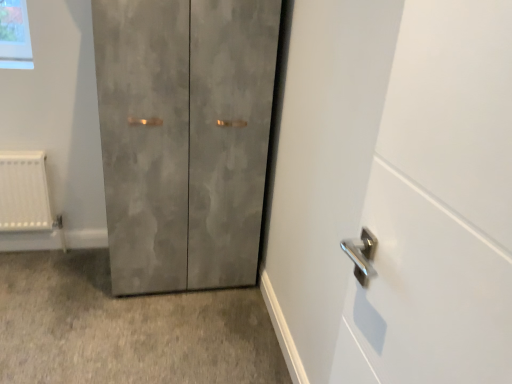
Locate an element on the screen. The height and width of the screenshot is (384, 512). concrete textured cabinet at lower left is located at coordinates (126, 328).

The height and width of the screenshot is (384, 512). Describe the element at coordinates (126, 328) in the screenshot. I see `concrete textured cabinet at lower left` at that location.

Describe the element at coordinates (185, 138) in the screenshot. I see `matte gray cabinet at center` at that location.

At what (x,y) coordinates should I click in order to perform the action: click on matte gray cabinet at center. Please return your answer as a coordinate pair (x, y). This screenshot has width=512, height=384. Looking at the image, I should click on (185, 138).

At what (x,y) coordinates should I click in order to perform the action: click on concrete textured cabinet at lower left. Please return your answer as a coordinate pair (x, y). This screenshot has width=512, height=384. Looking at the image, I should click on (126, 328).

Would you say concrete textured cabinet at lower left is to the left or to the right of matte gray cabinet at center in the picture?

A: Based on their positions, concrete textured cabinet at lower left is located to the left of matte gray cabinet at center.

Is concrete textured cabinet at lower left in front of or behind matte gray cabinet at center in the image?

In the image, concrete textured cabinet at lower left appears in front of matte gray cabinet at center.

Is point (97, 317) closer or farther from the camera than point (193, 72)?

Point (97, 317) appears to be farther away from the viewer than point (193, 72).

From the image's perspective, is concrete textured cabinet at lower left over matte gray cabinet at center?

No.

From a real-world perspective, between concrete textured cabinet at lower left and matte gray cabinet at center, who is vertically lower?

concrete textured cabinet at lower left, from a real-world perspective.

Looking at this image, considering the relative sizes of concrete textured cabinet at lower left and matte gray cabinet at center in the image provided, is concrete textured cabinet at lower left thinner than matte gray cabinet at center?

In fact, concrete textured cabinet at lower left might be wider than matte gray cabinet at center.

Which of these two, concrete textured cabinet at lower left or matte gray cabinet at center, stands taller?

matte gray cabinet at center.

Is concrete textured cabinet at lower left bigger than matte gray cabinet at center?

Incorrect, concrete textured cabinet at lower left is not larger than matte gray cabinet at center.

Is concrete textured cabinet at lower left inside or outside of matte gray cabinet at center?

concrete textured cabinet at lower left is outside matte gray cabinet at center.

Is concrete textured cabinet at lower left positioned far away from matte gray cabinet at center?

Actually, concrete textured cabinet at lower left and matte gray cabinet at center are a little close together.

Is concrete textured cabinet at lower left oriented towards matte gray cabinet at center?

No, concrete textured cabinet at lower left is not facing towards matte gray cabinet at center.

What's the angular difference between concrete textured cabinet at lower left and matte gray cabinet at center's facing directions?

89.8 degrees.

Measure the distance between concrete textured cabinet at lower left and matte gray cabinet at center.

They are 23.54 inches apart.

Find the location of a particular element. concrete below the matte gray cabinet at center (from a real-world perspective) is located at coordinates (126, 328).

Is matte gray cabinet at center at the left side of concrete textured cabinet at lower left?

No, matte gray cabinet at center is not to the left of concrete textured cabinet at lower left.

Considering the relative positions of matte gray cabinet at center and concrete textured cabinet at lower left in the image provided, is matte gray cabinet at center behind concrete textured cabinet at lower left?

Yes, it is.

Is point (226, 41) less distant than point (195, 361)?

Yes, point (226, 41) is in front of point (195, 361).

From the image's perspective, between matte gray cabinet at center and concrete textured cabinet at lower left, who is located below?

concrete textured cabinet at lower left is shown below in the image.

From a real-world perspective, is matte gray cabinet at center on concrete textured cabinet at lower left?

Indeed, from a real-world perspective, matte gray cabinet at center stands above concrete textured cabinet at lower left.

Considering the sizes of matte gray cabinet at center and concrete textured cabinet at lower left in the image, is matte gray cabinet at center wider or thinner than concrete textured cabinet at lower left?

In the image, matte gray cabinet at center appears to be more narrow than concrete textured cabinet at lower left.

Which of these two, matte gray cabinet at center or concrete textured cabinet at lower left, stands shorter?

concrete textured cabinet at lower left.

Can you confirm if matte gray cabinet at center is smaller than concrete textured cabinet at lower left?

Actually, matte gray cabinet at center might be larger than concrete textured cabinet at lower left.

Is matte gray cabinet at center completely or partially outside of concrete textured cabinet at lower left?

matte gray cabinet at center lies outside concrete textured cabinet at lower left's area.

Are matte gray cabinet at center and concrete textured cabinet at lower left beside each other?

matte gray cabinet at center is not next to concrete textured cabinet at lower left, and they're not touching.

Is matte gray cabinet at center oriented away from concrete textured cabinet at lower left?

No, matte gray cabinet at center is not facing the opposite direction of concrete textured cabinet at lower left.

Can you tell me how much matte gray cabinet at center and concrete textured cabinet at lower left differ in facing direction?

The facing directions of matte gray cabinet at center and concrete textured cabinet at lower left are 89.8 degrees apart.

Measure the distance between matte gray cabinet at center and concrete textured cabinet at lower left.

matte gray cabinet at center and concrete textured cabinet at lower left are 23.54 inches apart from each other.

In the image, there is a concrete textured cabinet at lower left. At what (x,y) coordinates should I click in order to perform the action: click on door above it (from the image's perspective). Please return your answer as a coordinate pair (x, y). The width and height of the screenshot is (512, 384). Looking at the image, I should click on (185, 138).

Image resolution: width=512 pixels, height=384 pixels. In the image, there is a concrete textured cabinet at lower left. Identify the location of door above it (from the image's perspective). (185, 138).

You are a GUI agent. You are given a task and a screenshot of the screen. Output one action in this format:
    pyautogui.click(x=<x>, y=<y>)
    Task: Click on the concrete to the left of matte gray cabinet at center
    
    Given the screenshot: What is the action you would take?
    pyautogui.click(x=126, y=328)